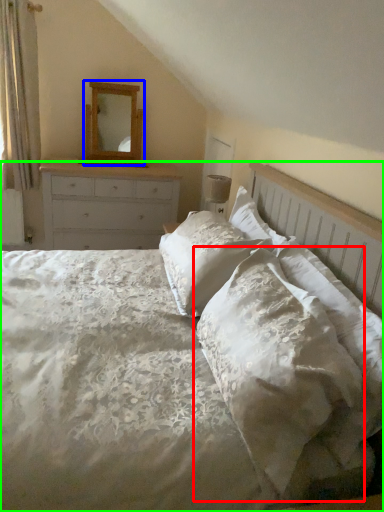
Question: Based on their relative distances, which object is farther from pillow (highlighted by a red box)? Choose from mirror (highlighted by a blue box) and bed (highlighted by a green box).

Choices:
 (A) mirror
 (B) bed

Answer: (A)